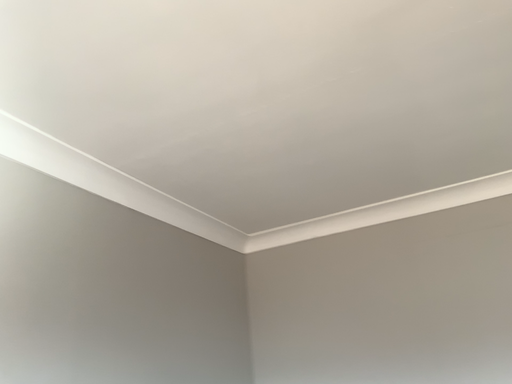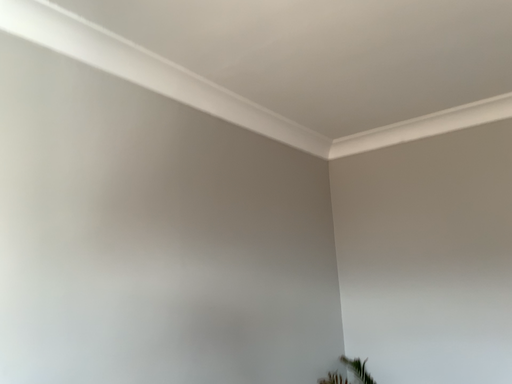
Question: Which way did the camera rotate in the video?

Choices:
 (A) rotated left
 (B) rotated right

Answer: (A)